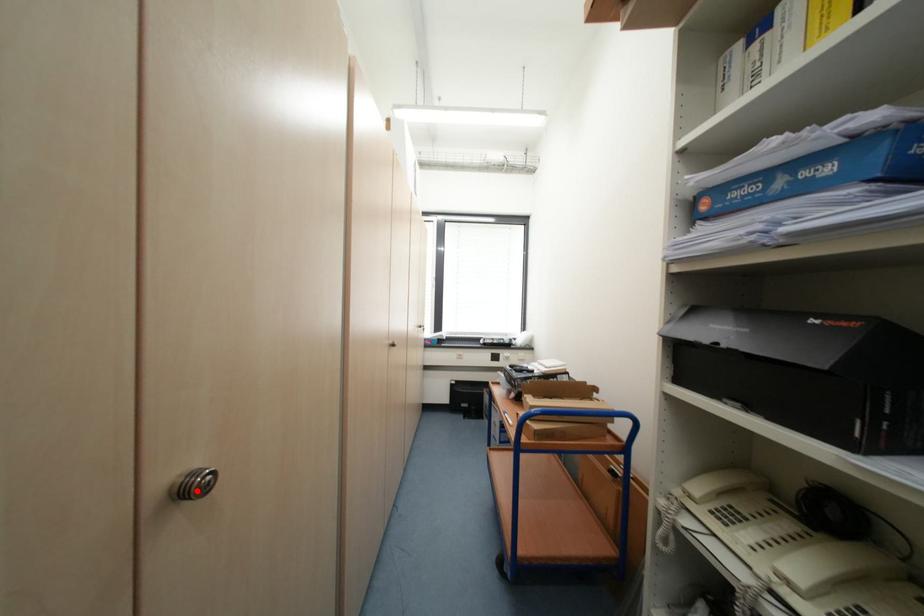
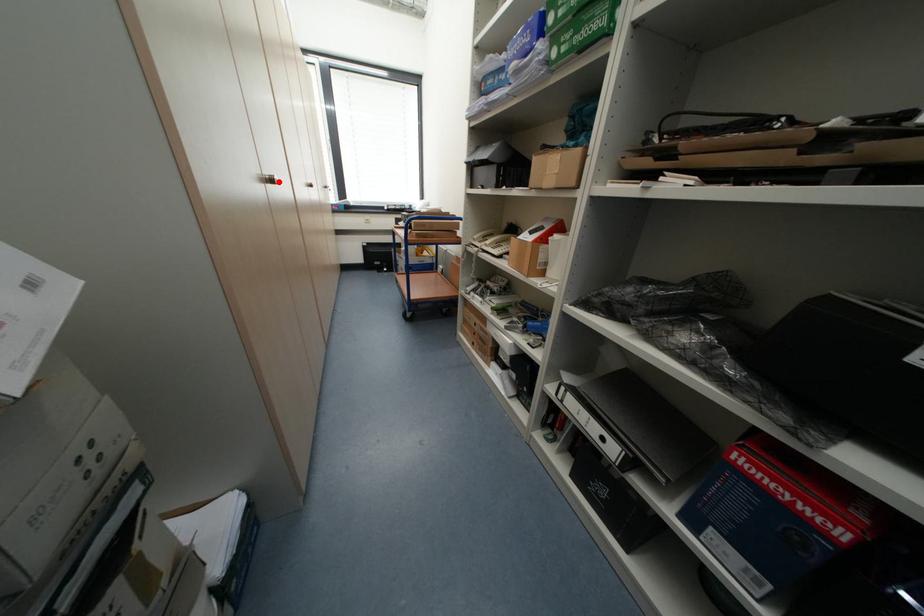
I am providing you with two images of the same scene from different viewpoints. A red point is marked on the first image and another point is marked on the second image. Is the marked point in image1 the same physical position as the marked point in image2?

Yes